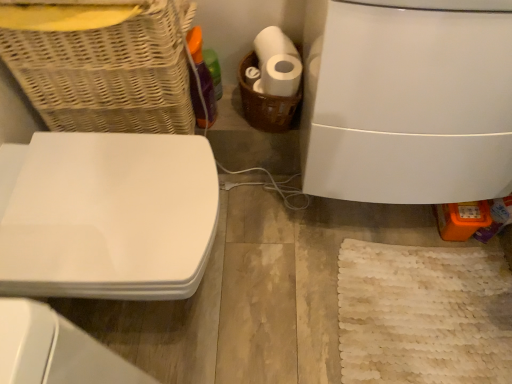
Question: Does white glossy toilet seat at left have a greater height compared to brown woven basket at center, positioned as the first basket in right-to-left order?

Choices:
 (A) yes
 (B) no

Answer: (A)

Question: Can you see white glossy toilet seat at left touching brown woven basket at center, which is the second basket in left-to-right order?

Choices:
 (A) yes
 (B) no

Answer: (B)

Question: Is white glossy toilet seat at left in front of brown woven basket at center, which is the second basket in left-to-right order?

Choices:
 (A) yes
 (B) no

Answer: (A)

Question: Is white glossy toilet seat at left at the right side of brown woven basket at center, positioned as the first basket in right-to-left order?

Choices:
 (A) yes
 (B) no

Answer: (B)

Question: From the image's perspective, does white glossy toilet seat at left appear higher than brown woven basket at center, positioned as the first basket in right-to-left order?

Choices:
 (A) yes
 (B) no

Answer: (B)

Question: Considering the positions of brown woven basket at center, positioned as the first basket in right-to-left order, and woven wicker basket at upper left, placed as the 1th basket when sorted from left to right, in the image, is brown woven basket at center, positioned as the first basket in right-to-left order, taller or shorter than woven wicker basket at upper left, placed as the 1th basket when sorted from left to right,?

Choices:
 (A) short
 (B) tall

Answer: (A)

Question: Would you say brown woven basket at center, positioned as the first basket in right-to-left order, is to the left or to the right of woven wicker basket at upper left, placed as the 1th basket when sorted from left to right, in the picture?

Choices:
 (A) right
 (B) left

Answer: (A)

Question: From a real-world perspective, is brown woven basket at center, which is the second basket in left-to-right order, positioned above or below woven wicker basket at upper left, placed as the 1th basket when sorted from left to right?

Choices:
 (A) below
 (B) above

Answer: (A)

Question: In terms of width, does brown woven basket at center, which is the second basket in left-to-right order, look wider or thinner when compared to woven wicker basket at upper left, placed as the 1th basket when sorted from left to right?

Choices:
 (A) wide
 (B) thin

Answer: (B)

Question: Looking at the image, does translucent purple bottle at upper left seem bigger or smaller compared to brown woven basket at center, which is the second basket in left-to-right order?

Choices:
 (A) small
 (B) big

Answer: (A)

Question: From the image's perspective, relative to brown woven basket at center, positioned as the first basket in right-to-left order, is translucent purple bottle at upper left above or below?

Choices:
 (A) above
 (B) below

Answer: (B)

Question: Considering the positions of translucent purple bottle at upper left and brown woven basket at center, which is the second basket in left-to-right order, in the image, is translucent purple bottle at upper left taller or shorter than brown woven basket at center, which is the second basket in left-to-right order,?

Choices:
 (A) tall
 (B) short

Answer: (A)

Question: Is point (202, 112) positioned closer to the camera than point (300, 84)?

Choices:
 (A) closer
 (B) farther

Answer: (B)

Question: From the image's perspective, is white glossy toilet at right positioned above or below brown woven basket at center, which is the second basket in left-to-right order?

Choices:
 (A) above
 (B) below

Answer: (B)

Question: Which is correct: white glossy toilet at right is inside brown woven basket at center, which is the second basket in left-to-right order, or outside of it?

Choices:
 (A) outside
 (B) inside

Answer: (A)